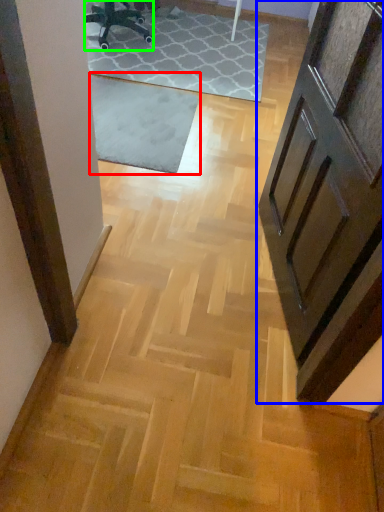
Question: Based on their relative distances, which object is nearer to mat (highlighted by a red box)? Choose from door (highlighted by a blue box) and chair (highlighted by a green box).

Choices:
 (A) door
 (B) chair

Answer: (B)